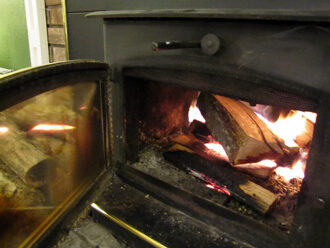
Locate an element on the screen. The width and height of the screenshot is (330, 248). fireplace is located at coordinates click(273, 39).